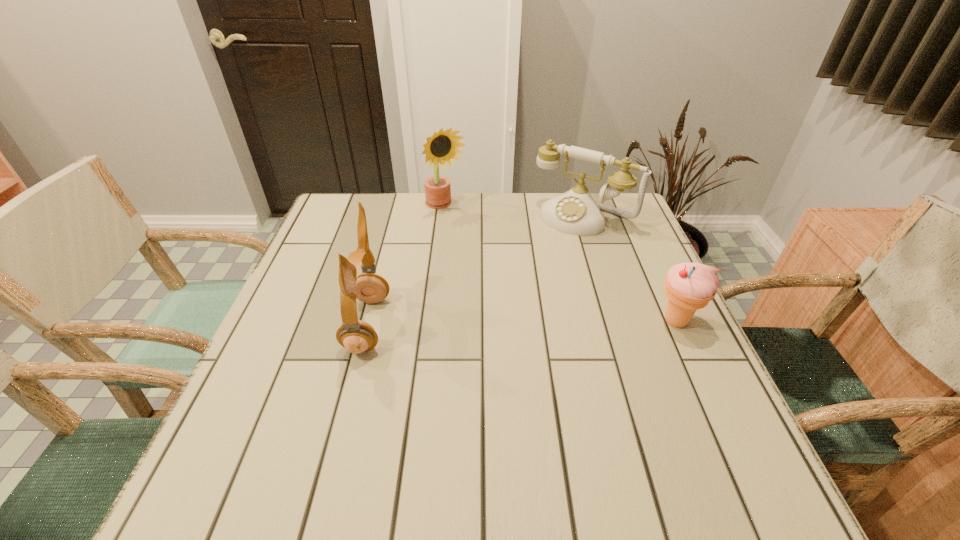
What are the coordinates of `vacant spot on the desktop that is between the earphone and the icecream and is positioned on the dial of the telephone` in the screenshot? It's located at (500, 323).

Locate an element on the screen. The image size is (960, 540). vacant space on the desktop that is between the leftmost object and the icecream and is positioned on the face of the sunflower is located at coordinates (540, 323).